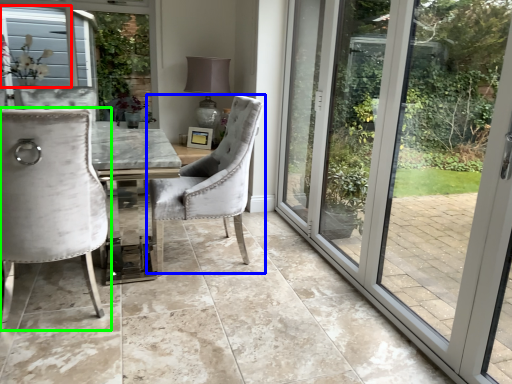
Question: Which object is positioned farthest from window screen (highlighted by a red box)? Select from chair (highlighted by a blue box) and chair (highlighted by a green box).

Choices:
 (A) chair
 (B) chair

Answer: (B)